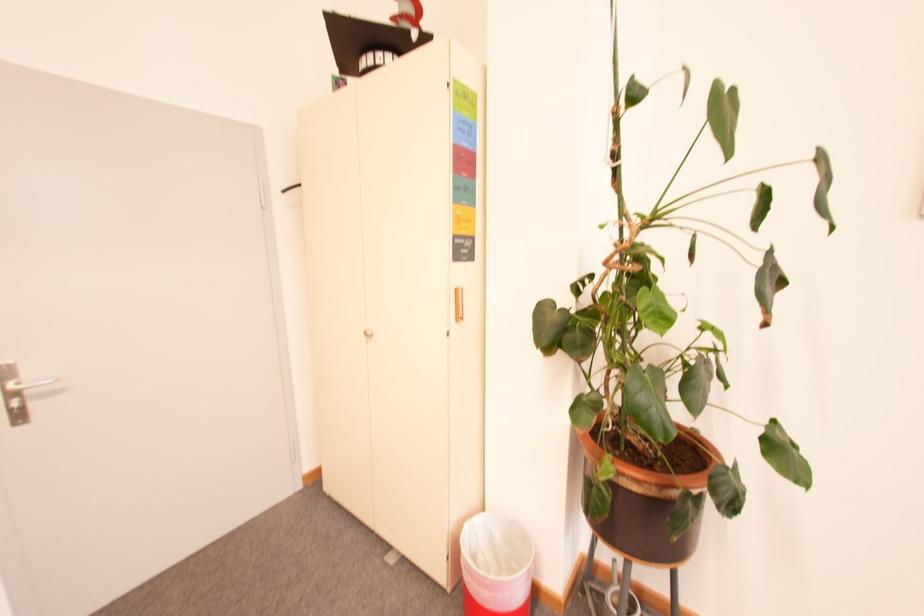
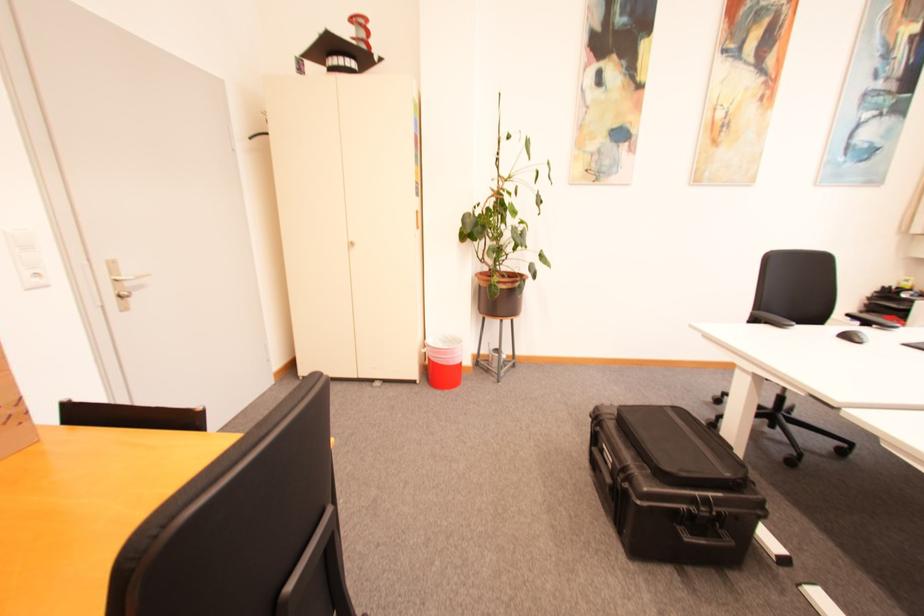
In the second image, find the point that corresponds to point 373,334 in the first image.

(359, 245)